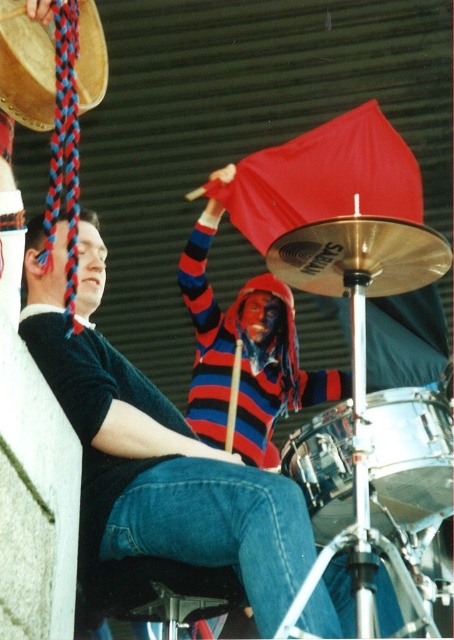
You are a photographer trying to capture a candid shot of the striped sweater at center and denim at left. Which one should you focus on first if you want to capture both in a single frame without moving the camera?

The striped sweater at center is above denim at left, so you should focus on the striped sweater at center first to ensure both are in the frame without moving the camera.

From the picture: You are a musician who wants to play both the shiny silver drum at center and the wooden drum at upper left. Which drum should you move towards first if you are standing to the left of both drums?

You should move towards the wooden drum at upper left first because it is located to the left of the shiny silver drum at center.